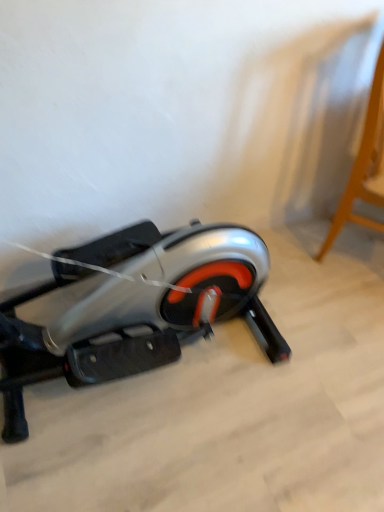
Question: Does light wood stool at upper right touch silver metallic stationary bicycle at lower left?

Choices:
 (A) no
 (B) yes

Answer: (A)

Question: Is light wood stool at upper right taller than silver metallic stationary bicycle at lower left?

Choices:
 (A) no
 (B) yes

Answer: (B)

Question: Does light wood stool at upper right turn towards silver metallic stationary bicycle at lower left?

Choices:
 (A) no
 (B) yes

Answer: (A)

Question: Can you confirm if light wood stool at upper right is shorter than silver metallic stationary bicycle at lower left?

Choices:
 (A) yes
 (B) no

Answer: (B)

Question: From a real-world perspective, does light wood stool at upper right stand above silver metallic stationary bicycle at lower left?

Choices:
 (A) yes
 (B) no

Answer: (A)

Question: From the image's perspective, is light wood stool at upper right beneath silver metallic stationary bicycle at lower left?

Choices:
 (A) no
 (B) yes

Answer: (A)

Question: Are silver metallic stationary bicycle at lower left and light wood stool at upper right beside each other?

Choices:
 (A) no
 (B) yes

Answer: (A)

Question: From the image's perspective, would you say silver metallic stationary bicycle at lower left is positioned over light wood stool at upper right?

Choices:
 (A) no
 (B) yes

Answer: (A)

Question: From a real-world perspective, is silver metallic stationary bicycle at lower left on light wood stool at upper right?

Choices:
 (A) no
 (B) yes

Answer: (A)

Question: Does silver metallic stationary bicycle at lower left come in front of light wood stool at upper right?

Choices:
 (A) no
 (B) yes

Answer: (B)

Question: Does silver metallic stationary bicycle at lower left appear on the left side of light wood stool at upper right?

Choices:
 (A) no
 (B) yes

Answer: (B)

Question: Are silver metallic stationary bicycle at lower left and light wood stool at upper right far apart?

Choices:
 (A) no
 (B) yes

Answer: (A)

Question: In terms of height, does light wood stool at upper right look taller or shorter compared to silver metallic stationary bicycle at lower left?

Choices:
 (A) tall
 (B) short

Answer: (A)